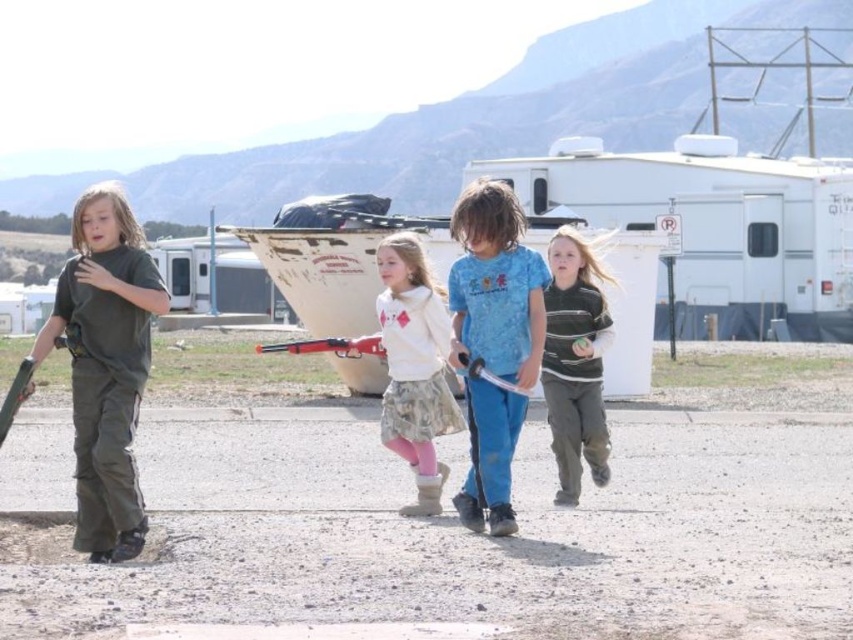
You are a photographer trying to capture a group photo of the matte black shirt at left and the blue cotton shirt at center. Since you want to ensure both are clearly visible, which child should you focus on first to ensure proper exposure?

A: The matte black shirt at left should be focused on first because it is bigger than the blue cotton shirt at center, making it more prominent in the frame.

You are a photographer trying to capture a group photo of the matte black shirt at left and the blue cotton shirt at center. Since you want to ensure both subjects are clearly visible, which of the two should you position closer to the camera to avoid them appearing too small in the photo?

The blue cotton shirt at center should be positioned closer to the camera because it is narrower than the matte black shirt at left, so moving it forward will help balance their sizes in the photo.

You are a parent trying to locate your child who is hiding behind an object in the image. The white matte boat at center is located at coordinates 0.416, 0.399. Can you determine if the boat is positioned to the left or right of the center point of the image?

The white matte boat at center is exactly at the center point of the image since its coordinates are (339,266), which are close to the center coordinates of an image typically represented as (426,320).